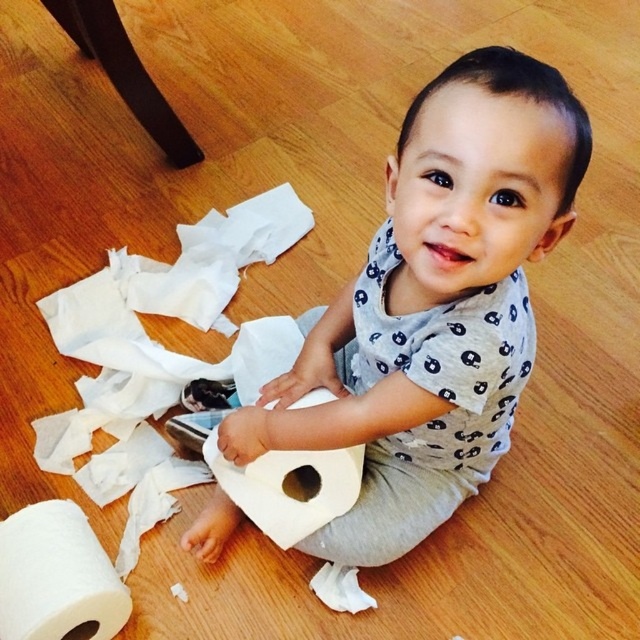
You are a parent trying to clean up the scattered items. You need to determine which item is wider to decide which to pick up first. Which one is wider between the white matte paper towel at center and the white paper at center?

The white matte paper towel at center is wider than the white paper at center, so you should pick up the white matte paper towel at center first.

You are a parent trying to clean up the scattered white matte paper towel at center. You see a point at coordinates (435, 305). Is this point located on the white matte paper towel at center?

Yes, the point at coordinates (435, 305) is located on the white matte paper towel at center.

You are a parent trying to clean up the scattered white matte paper towel at center and white matte paper towel at lower left. Which one requires a larger trash bag to dispose of properly?

The white matte paper towel at center requires a larger trash bag because its width surpasses that of the white matte paper towel at lower left.